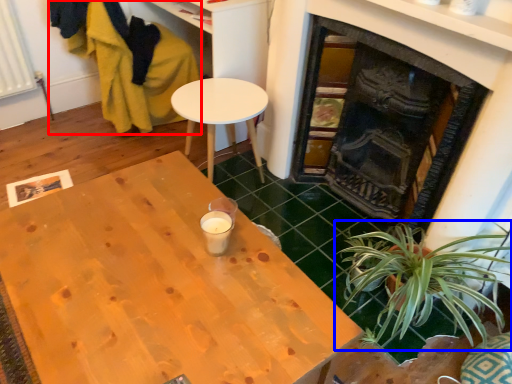
Question: Which of the following is the farthest to the observer, swivel chair (highlighted by a red box) or houseplant (highlighted by a blue box)?

Choices:
 (A) swivel chair
 (B) houseplant

Answer: (A)